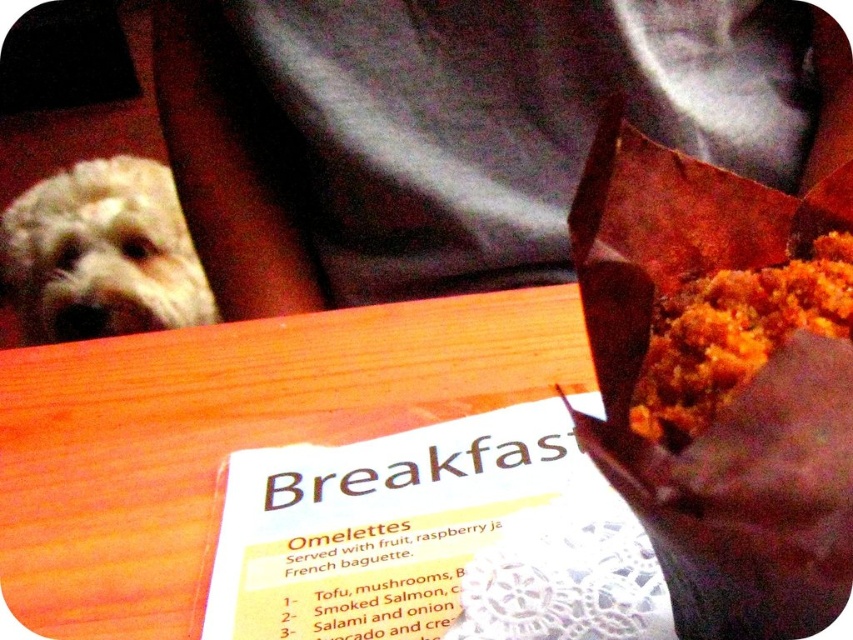
You are a chef trying to place the golden crumbly muffin at upper right on a plate that can only hold items narrower than the white fluffy dog at upper left. Can the muffin fit on the plate?

The white fluffy dog at upper left might be wider than the golden crumbly muffin at upper right, so the muffin should fit on the plate since it is narrower than the dog.

You are a customer at this breakfast spot and you see the white fluffy dog at upper left and the golden crumbly muffin at upper right. Which object is located more to the left side?

The white fluffy dog at upper left is more to the left side.